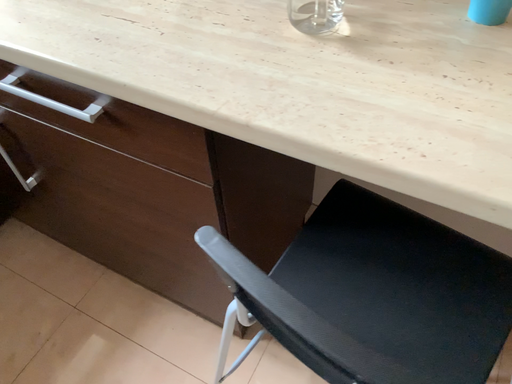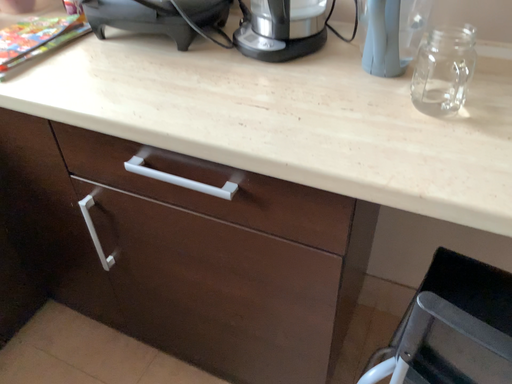
Question: Which way did the camera rotate in the video?

Choices:
 (A) rotated downward
 (B) rotated upward

Answer: (B)